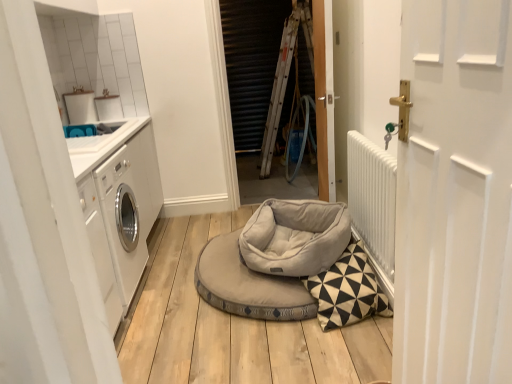
Question: Would you say light gray fabric dog bed at center, the second dog bed when ordered from top to bottom, is to the left or to the right of white matte door at right, acting as the 1th door starting from the front, in the picture?

Choices:
 (A) left
 (B) right

Answer: (A)

Question: From a real-world perspective, relative to white matte door at right, acting as the 1th door starting from the front, is light gray fabric dog bed at center, marked as the first dog bed in a bottom-to-top arrangement, vertically above or below?

Choices:
 (A) above
 (B) below

Answer: (B)

Question: Considering the real-world distances, which object is farthest from the white glossy washing machine at left?

Choices:
 (A) metallic silver screen door at center
 (B) white textured radiator at right
 (C) white matte door at right, acting as the 1th door starting from the front
 (D) light gray plush dog bed at center, which ranks as the 1th dog bed in top-to-bottom order
 (E) light gray fabric dog bed at center, the second dog bed when ordered from top to bottom

Answer: (A)

Question: Which object is positioned closest to the wooden door at center, placed as the 2th door when sorted from front to back?

Choices:
 (A) white glossy washing machine at left
 (B) metallic silver screen door at center
 (C) light gray fabric dog bed at center, marked as the first dog bed in a bottom-to-top arrangement
 (D) light gray plush dog bed at center, which ranks as the 1th dog bed in top-to-bottom order
 (E) white matte door at right, acting as the 1th door starting from the front

Answer: (D)